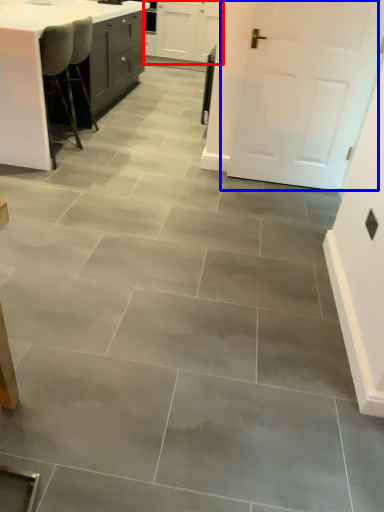
Question: Which of the following is the farthest to the observer, cabinetry (highlighted by a red box) or door (highlighted by a blue box)?

Choices:
 (A) cabinetry
 (B) door

Answer: (A)